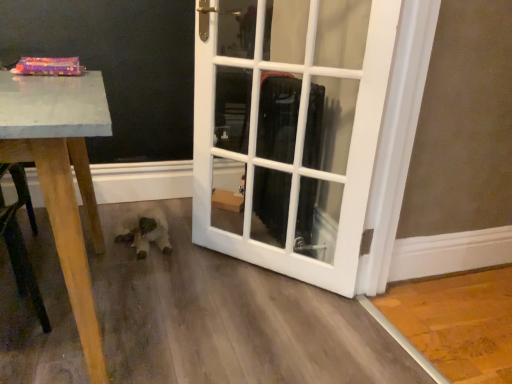
Where is `free space that is to the left of white plush toy at lower center`? This screenshot has height=384, width=512. free space that is to the left of white plush toy at lower center is located at coordinates (99, 226).